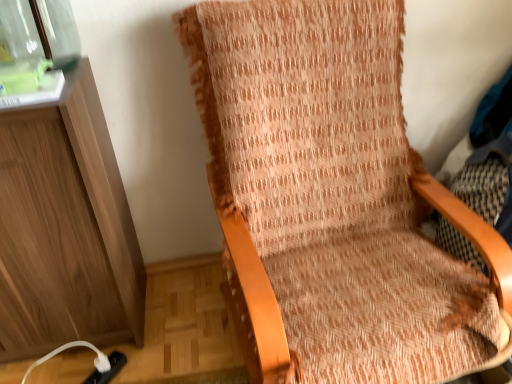
Question: Is textured orange fabric chair at center behind transparent glass jar at upper left?

Choices:
 (A) no
 (B) yes

Answer: (A)

Question: From a real-world perspective, is textured orange fabric chair at center below transparent glass jar at upper left?

Choices:
 (A) no
 (B) yes

Answer: (B)

Question: Does textured orange fabric chair at center come in front of transparent glass jar at upper left?

Choices:
 (A) yes
 (B) no

Answer: (A)

Question: Is textured orange fabric chair at center located outside transparent glass jar at upper left?

Choices:
 (A) no
 (B) yes

Answer: (B)

Question: Can you see textured orange fabric chair at center touching transparent glass jar at upper left?

Choices:
 (A) no
 (B) yes

Answer: (A)

Question: Can you confirm if textured orange fabric chair at center is wider than transparent glass jar at upper left?

Choices:
 (A) yes
 (B) no

Answer: (A)

Question: From the image's perspective, does transparent glass jar at upper left appear lower than textured orange fabric chair at center?

Choices:
 (A) no
 (B) yes

Answer: (A)

Question: Does transparent glass jar at upper left have a lesser width compared to textured orange fabric chair at center?

Choices:
 (A) no
 (B) yes

Answer: (B)

Question: Is textured orange fabric chair at center at the back of transparent glass jar at upper left?

Choices:
 (A) yes
 (B) no

Answer: (B)

Question: From the image's perspective, would you say transparent glass jar at upper left is positioned over textured orange fabric chair at center?

Choices:
 (A) no
 (B) yes

Answer: (B)

Question: Can you confirm if transparent glass jar at upper left is wider than textured orange fabric chair at center?

Choices:
 (A) no
 (B) yes

Answer: (A)

Question: From a real-world perspective, is transparent glass jar at upper left on top of textured orange fabric chair at center?

Choices:
 (A) no
 (B) yes

Answer: (B)

Question: Is transparent glass jar at upper left taller or shorter than textured orange fabric chair at center?

Choices:
 (A) short
 (B) tall

Answer: (A)